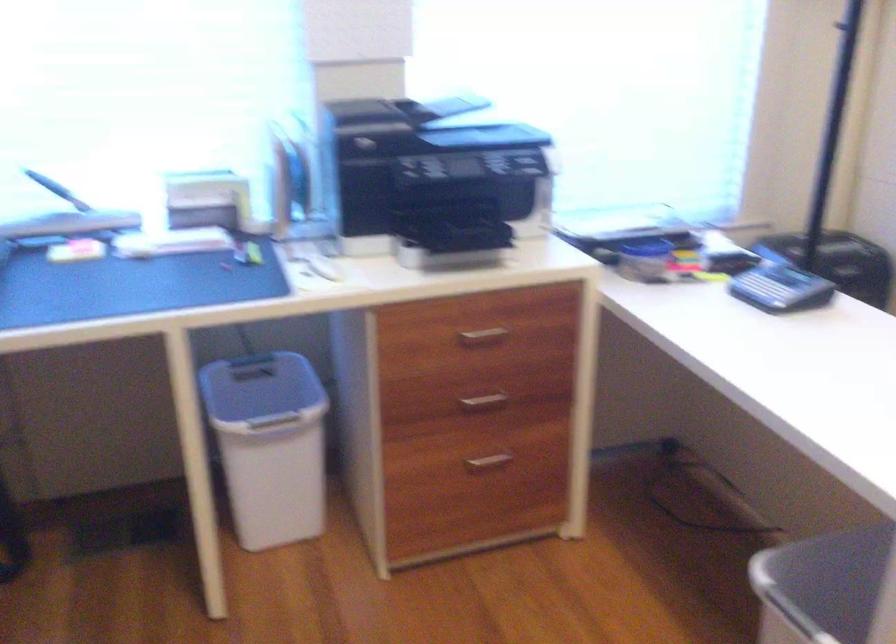
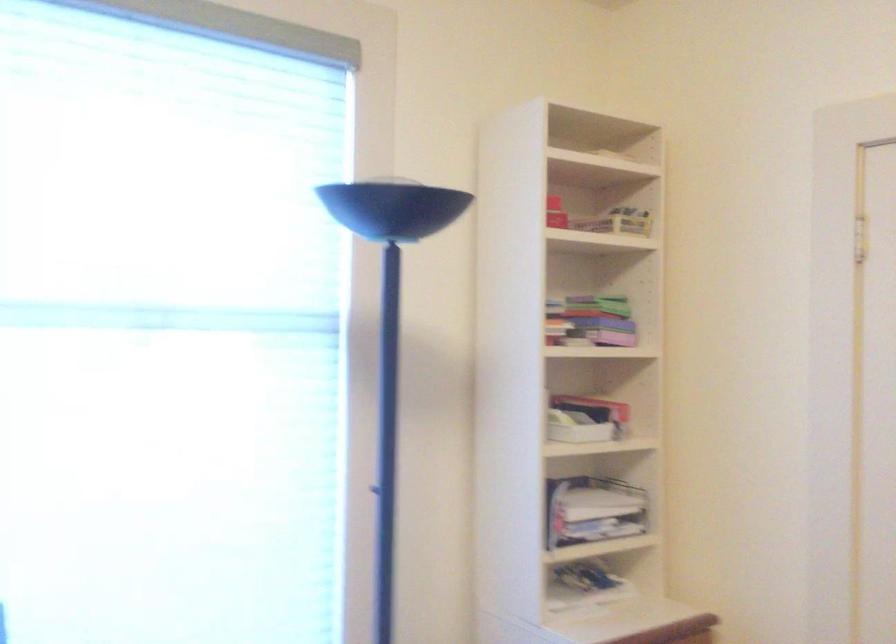
The first image is from the beginning of the video and the second image is from the end. How did the camera likely rotate when shooting the video?

The camera's rotation is toward right-up.